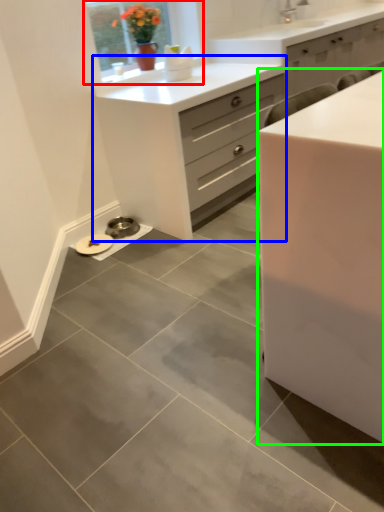
Question: Considering the real-world distances, which object is farthest from window (highlighted by a red box)? chest of drawers (highlighted by a blue box) or chest of drawers (highlighted by a green box)?

Choices:
 (A) chest of drawers
 (B) chest of drawers

Answer: (B)